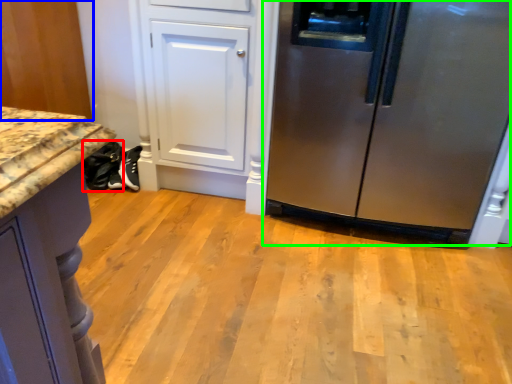
Question: Considering the real-world distances, which object is farthest from footwear (highlighted by a red box)? cabinetry (highlighted by a blue box) or refrigerator (highlighted by a green box)?

Choices:
 (A) cabinetry
 (B) refrigerator

Answer: (B)